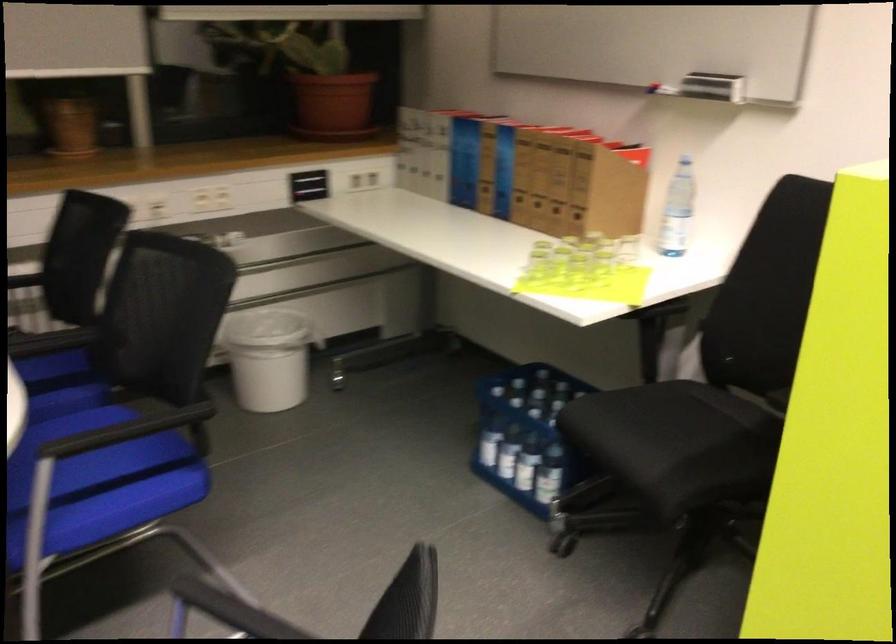
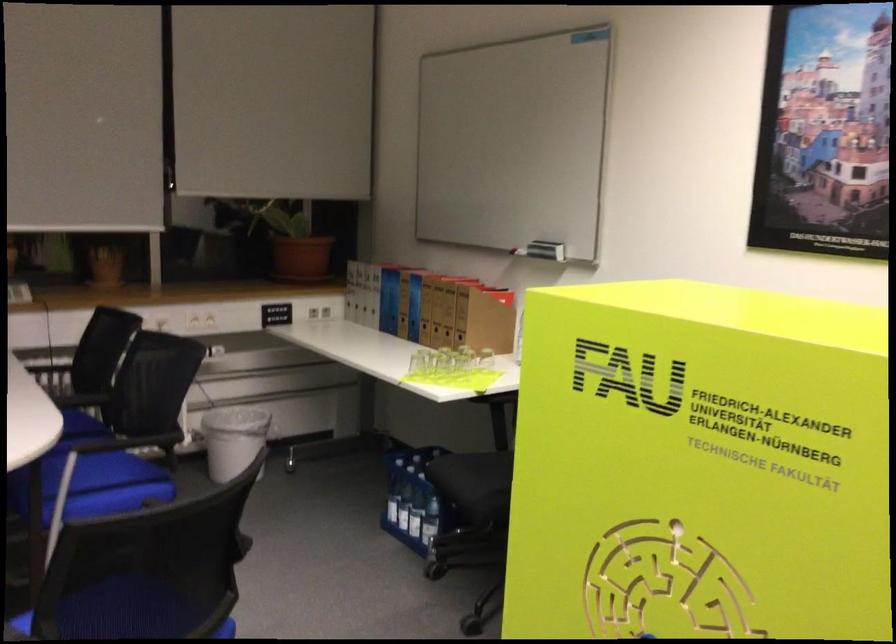
Where in the second image is the point corresponding to (x=448, y=192) from the first image?

(382, 321)